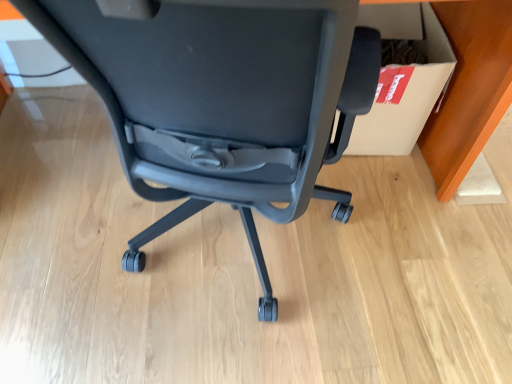
Where is `free space in front of white cardboard box at right`? The height and width of the screenshot is (384, 512). free space in front of white cardboard box at right is located at coordinates (387, 186).